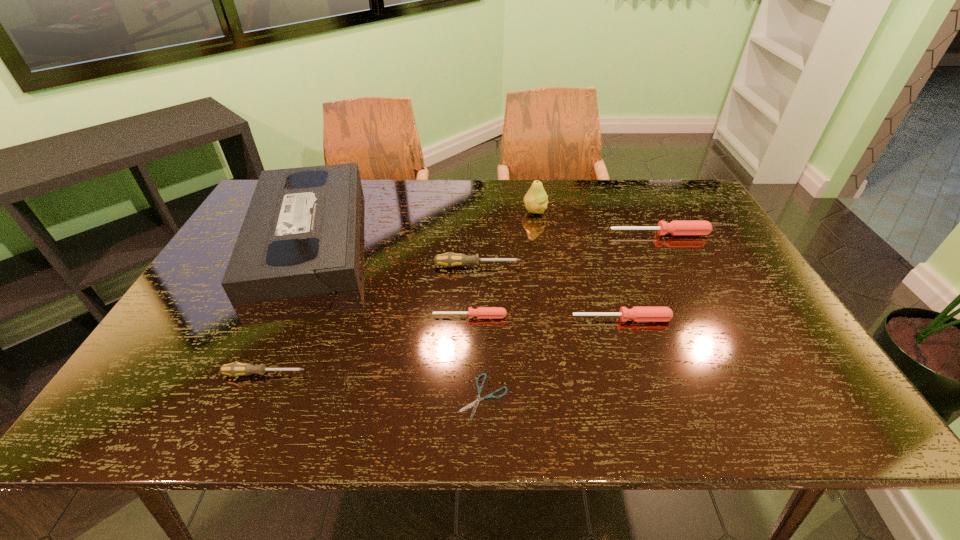
This screenshot has width=960, height=540. I want to click on the seventh tallest object, so click(481, 312).

The width and height of the screenshot is (960, 540). Find the location of `the shortest screwdriver`. the shortest screwdriver is located at coordinates (481, 312).

Where is `shears`? The width and height of the screenshot is (960, 540). shears is located at coordinates (475, 403).

Locate an element on the screen. the shortest object is located at coordinates (475, 403).

Find the location of a particular element. The image size is (960, 540). free space located 0.300m on the front of the sixth object from left to right is located at coordinates (546, 283).

In order to click on free spot located 0.110m on the right of the second tallest object in this screenshot , I will do click(412, 233).

At what (x,y) coordinates should I click in order to perform the action: click on vacant area situated 0.090m at the tip of the right gray screwdriver. Please return your answer as a coordinate pair (x, y). Looking at the image, I should click on (553, 266).

Image resolution: width=960 pixels, height=540 pixels. Identify the location of vacant point located on the front of the farthest red screwdriver. (684, 281).

Locate an element on the screen. The width and height of the screenshot is (960, 540). free space located 0.260m on the back of the second smallest red screwdriver is located at coordinates (599, 248).

What are the coordinates of `vacant space located at the tip of the smaller gray screwdriver` in the screenshot? It's located at (339, 374).